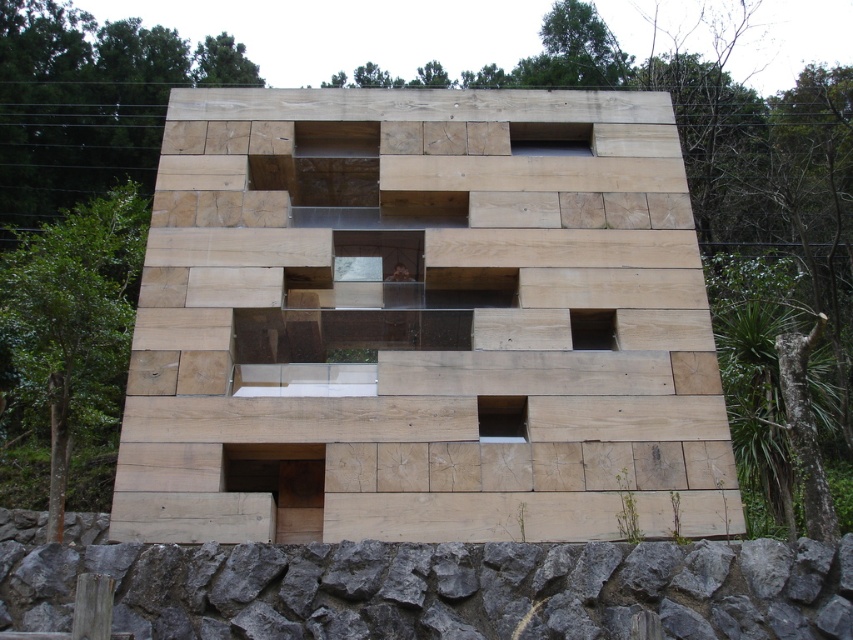
Question: Which of the following is the closest to the observer?

Choices:
 (A) (219, 406)
 (B) (548, 561)

Answer: (B)

Question: Which of the following is the closest to the observer?

Choices:
 (A) gray rough stone at lower center
 (B) natural wood plywood at center

Answer: (A)

Question: Is natural wood plywood at center further to camera compared to gray rough stone at lower center?

Choices:
 (A) yes
 (B) no

Answer: (A)

Question: Among these points, which one is nearest to the camera?

Choices:
 (A) (132, 621)
 (B) (366, 378)

Answer: (A)

Question: Is natural wood plywood at center positioned at the back of gray rough stone at lower center?

Choices:
 (A) yes
 (B) no

Answer: (A)

Question: Is natural wood plywood at center positioned behind gray rough stone at lower center?

Choices:
 (A) no
 (B) yes

Answer: (B)